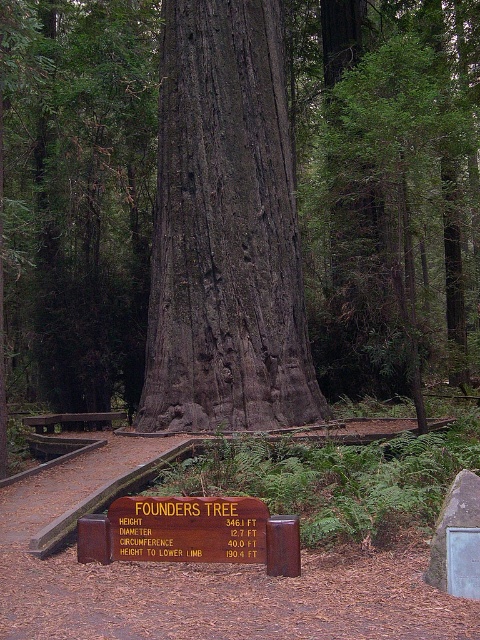
Question: Is dark gray bark tree at center bigger than brown wooden bench at center?

Choices:
 (A) yes
 (B) no

Answer: (A)

Question: Among these objects, which one is nearest to the camera?

Choices:
 (A) brown wooden bench at center
 (B) dark brown bark tree at center
 (C) brown wooden sign at center

Answer: (C)

Question: Is dark brown bark tree at center below brown wooden sign at center?

Choices:
 (A) no
 (B) yes

Answer: (A)

Question: Which object appears farthest from the camera in this image?

Choices:
 (A) dark brown bark tree at center
 (B) brown wooden bench at center

Answer: (B)

Question: Estimate the real-world distances between objects in this image. Which object is farther from the brown wooden bench at center?

Choices:
 (A) dark brown bark tree at center
 (B) brown wooden sign at center
 (C) dark gray bark tree at center

Answer: (B)

Question: Observing the image, what is the correct spatial positioning of dark brown bark tree at center in reference to brown wooden bench at center?

Choices:
 (A) right
 (B) left

Answer: (A)